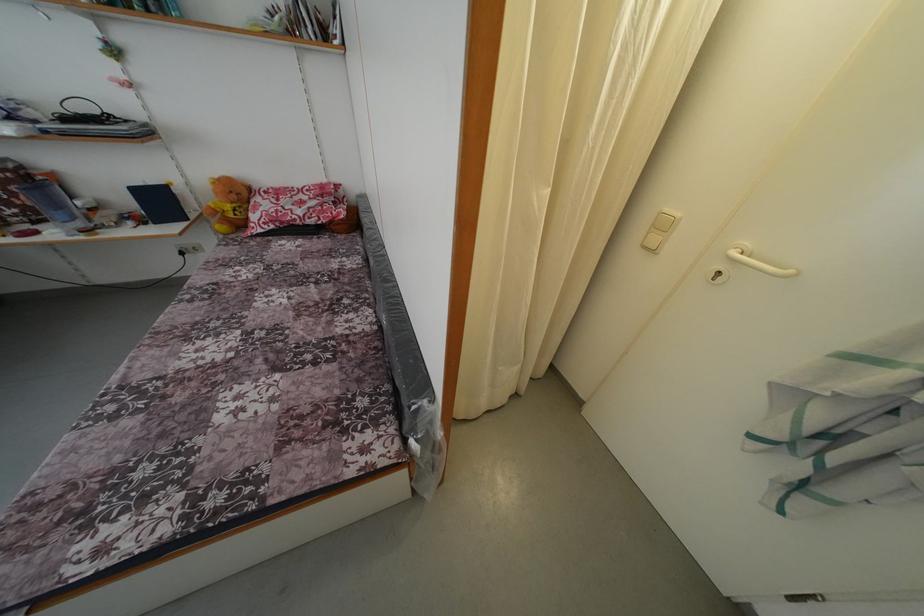
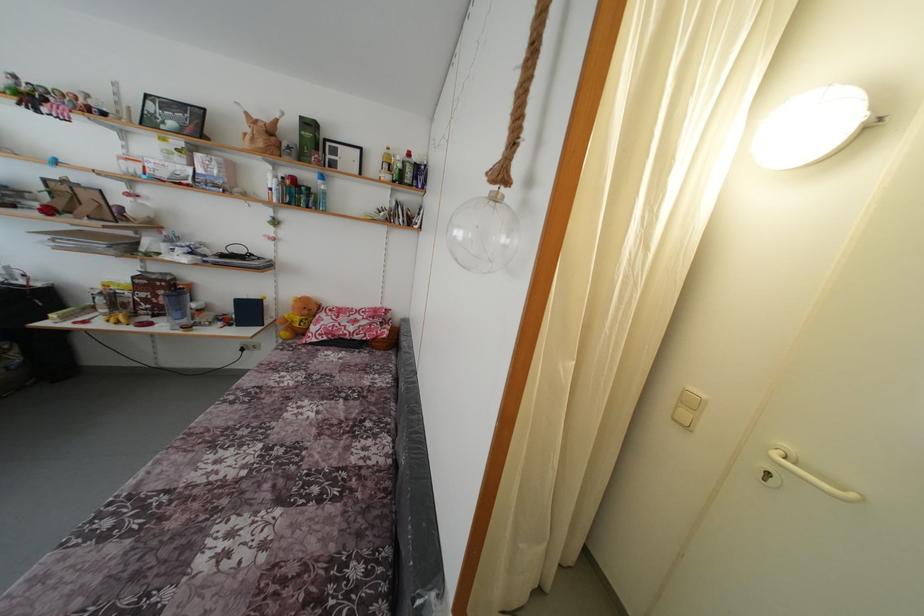
In the second image, find the point that corresponds to the point at 239,203 in the first image.

(310, 317)